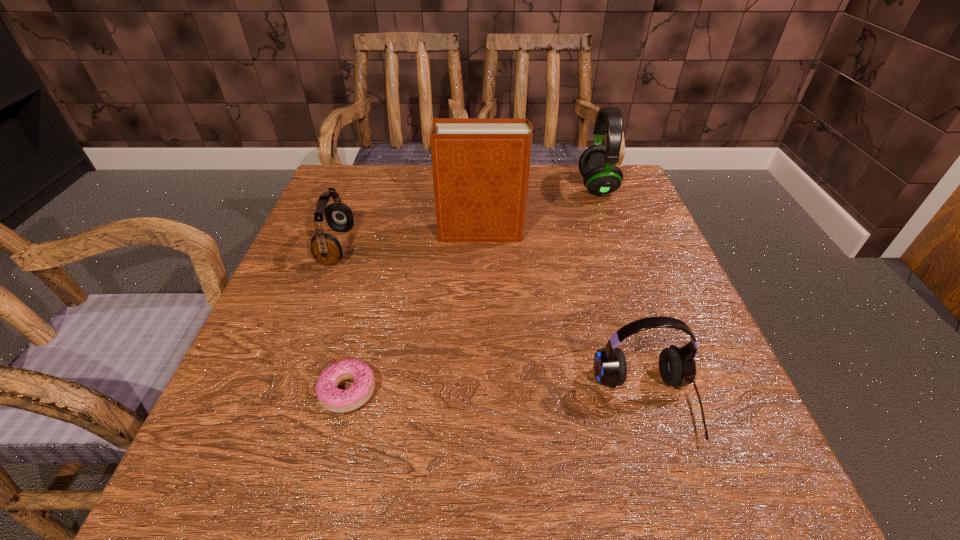
You are a GUI agent. You are given a task and a screenshot of the screen. Output one action in this format:
    pyautogui.click(x=<x>, y=<y>)
    Task: Click on the headset present at the left edge
    The width and height of the screenshot is (960, 540).
    Given the screenshot: What is the action you would take?
    pyautogui.click(x=325, y=248)

Find the location of a particular element. This screenshot has width=960, height=540. doughnut situated at the left edge is located at coordinates (336, 400).

Locate an element on the screen. object that is at the far right corner is located at coordinates (597, 164).

Identify the location of object situated at the near right corner. (677, 367).

In the image, there is a desktop. At what (x,y) coordinates should I click in order to perform the action: click on free space at the far edge. Please return your answer as a coordinate pair (x, y). This screenshot has height=540, width=960. Looking at the image, I should click on (564, 201).

This screenshot has height=540, width=960. In order to click on free space at the near edge in this screenshot , I will do `click(472, 453)`.

Locate an element on the screen. blank space at the left edge of the desktop is located at coordinates (356, 278).

This screenshot has height=540, width=960. In the image, there is a desktop. What are the coordinates of `vacant space at the right edge` in the screenshot? It's located at (635, 409).

The width and height of the screenshot is (960, 540). In order to click on blank space at the far left corner of the desktop in this screenshot , I will do `click(351, 200)`.

Identify the location of blank space at the near left corner of the desktop. This screenshot has width=960, height=540. (182, 485).